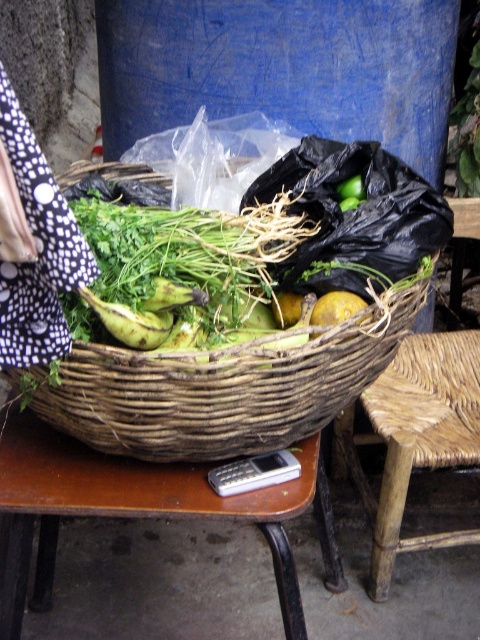
You are standing at the origin point of the coordinate system. You want to place a new object at the position of the brown wooden table at lower center. What are the coordinates where you should place it?

The coordinates for the brown wooden table at lower center are at point (136, 509).

You are organizing vegetables in a rustic kitchen. You have a woven brown basket at center and a yellow matte potato at center. Which object is located lower in the scene?

The woven brown basket at center is positioned under the yellow matte potato at center, so the basket is lower than the potato.

You are a delivery person who needs to place a package on the table. The package is 10 inches long. Can you fit the package horizontally between the woven brown basket at center and the brown wooden table at lower center?

The distance between the woven brown basket at center and the brown wooden table at lower center is 8.24 inches, which is shorter than the package length of 10 inches. Therefore, the package cannot be placed horizontally between them.